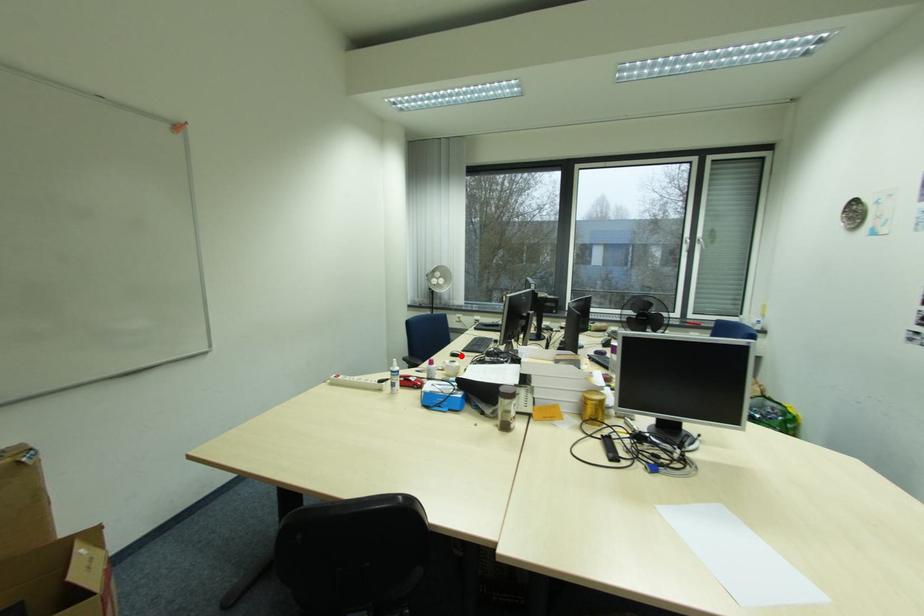
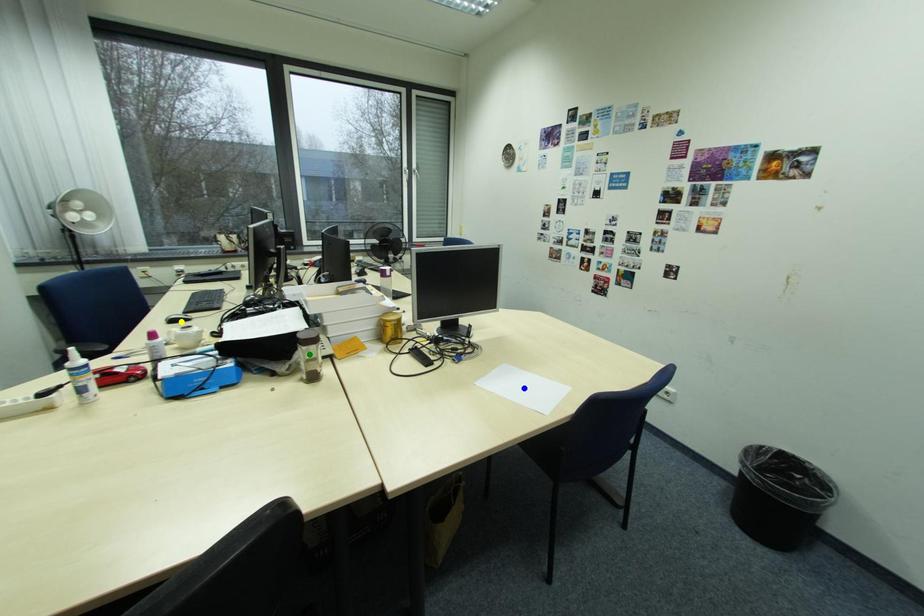
Question: I am providing you with two images of the same scene from different viewpoints. A red point is marked on the first image. You are given multiple points on the second image. Which mark in image 2 goes with the point in image 1?

Choices:
 (A) yellow point
 (B) green point
 (C) blue point

Answer: (A)